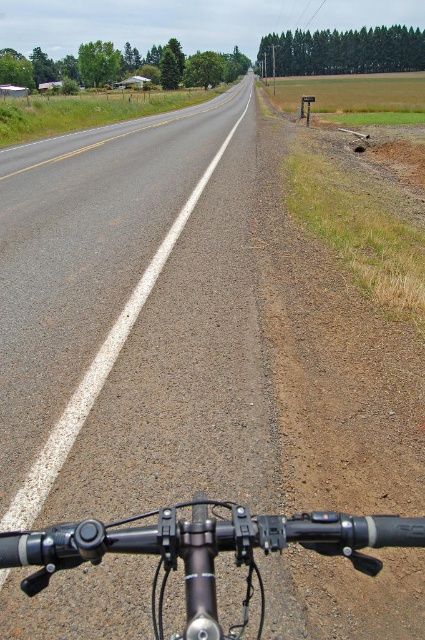
You are riding a bicycle and looking at the shiny black handlebars at bottom center and the asphalt road at center. Which object is closer to you?

The shiny black handlebars at bottom center are closer to you because they are positioned in front of the asphalt road at center.

You are riding a bicycle and want to check if your handlebars are blocking your view of the road ahead. Based on the image, are the shiny black handlebars at bottom center covering any part of the asphalt road at center?

The shiny black handlebars at bottom center are positioned under the asphalt road at center, so they are not covering the road but are located below it in the image.